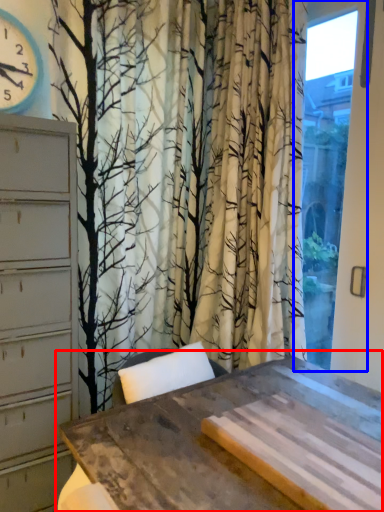
Question: Which object appears closest to the camera in this image, table (highlighted by a red box) or window (highlighted by a blue box)?

Choices:
 (A) table
 (B) window

Answer: (A)